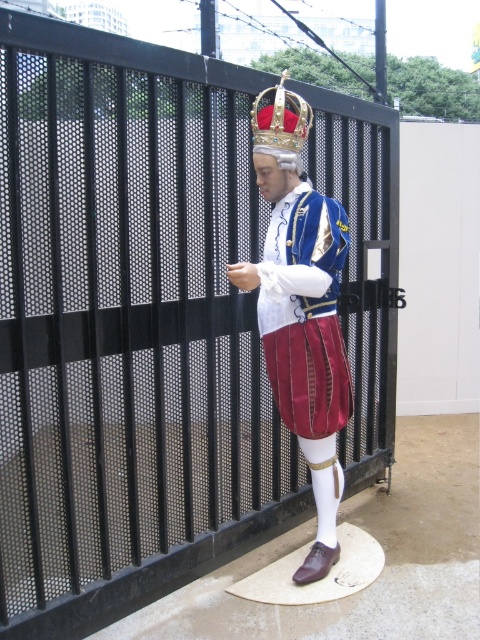
Question: Which object is farther from the camera taking this photo?

Choices:
 (A) velvet maroon pants at center
 (B) velvet blue jacket at center

Answer: (A)

Question: Is velvet maroon pants at center thinner than goldmetalliccrown at upper center?

Choices:
 (A) no
 (B) yes

Answer: (A)

Question: Can you confirm if velvet maroon pants at center is positioned to the right of goldmetalliccrown at upper center?

Choices:
 (A) no
 (B) yes

Answer: (B)

Question: Based on their relative distances, which object is farther from the goldmetalliccrown at upper center?

Choices:
 (A) velvet maroon pants at center
 (B) velvet blue jacket at center

Answer: (A)

Question: Which point is farther from the camera taking this photo?

Choices:
 (A) (311, 292)
 (B) (303, 412)

Answer: (B)

Question: Observing the image, what is the correct spatial positioning of velvet blue jacket at center in reference to velvet maroon pants at center?

Choices:
 (A) right
 (B) left

Answer: (B)